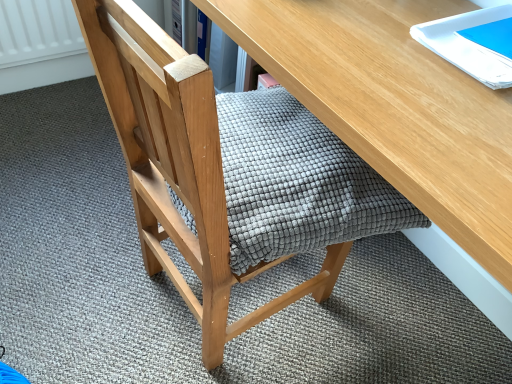
Question: Is wooden desk at center aimed at textured gray cushion at center?

Choices:
 (A) yes
 (B) no

Answer: (A)

Question: Does wooden desk at center have a lesser width compared to textured gray cushion at center?

Choices:
 (A) yes
 (B) no

Answer: (B)

Question: Considering the relative positions of wooden desk at center and textured gray cushion at center in the image provided, is wooden desk at center behind textured gray cushion at center?

Choices:
 (A) no
 (B) yes

Answer: (A)

Question: From a real-world perspective, is wooden desk at center on top of textured gray cushion at center?

Choices:
 (A) no
 (B) yes

Answer: (A)

Question: Does wooden desk at center appear on the left side of textured gray cushion at center?

Choices:
 (A) yes
 (B) no

Answer: (B)

Question: Can you confirm if wooden desk at center is positioned to the right of textured gray cushion at center?

Choices:
 (A) no
 (B) yes

Answer: (B)

Question: Does white glossy notebook at upper right have a greater width compared to textured gray cushion at center?

Choices:
 (A) yes
 (B) no

Answer: (B)

Question: From a real-world perspective, is white glossy notebook at upper right located beneath textured gray cushion at center?

Choices:
 (A) yes
 (B) no

Answer: (B)

Question: Is white glossy notebook at upper right positioned beyond the bounds of textured gray cushion at center?

Choices:
 (A) yes
 (B) no

Answer: (A)

Question: Can textured gray cushion at center be found inside white glossy notebook at upper right?

Choices:
 (A) yes
 (B) no

Answer: (B)

Question: Are white glossy notebook at upper right and textured gray cushion at center beside each other?

Choices:
 (A) no
 (B) yes

Answer: (A)

Question: Is white glossy notebook at upper right smaller than textured gray cushion at center?

Choices:
 (A) yes
 (B) no

Answer: (A)

Question: Can you confirm if white glossy notebook at upper right is wider than wooden desk at center?

Choices:
 (A) yes
 (B) no

Answer: (B)